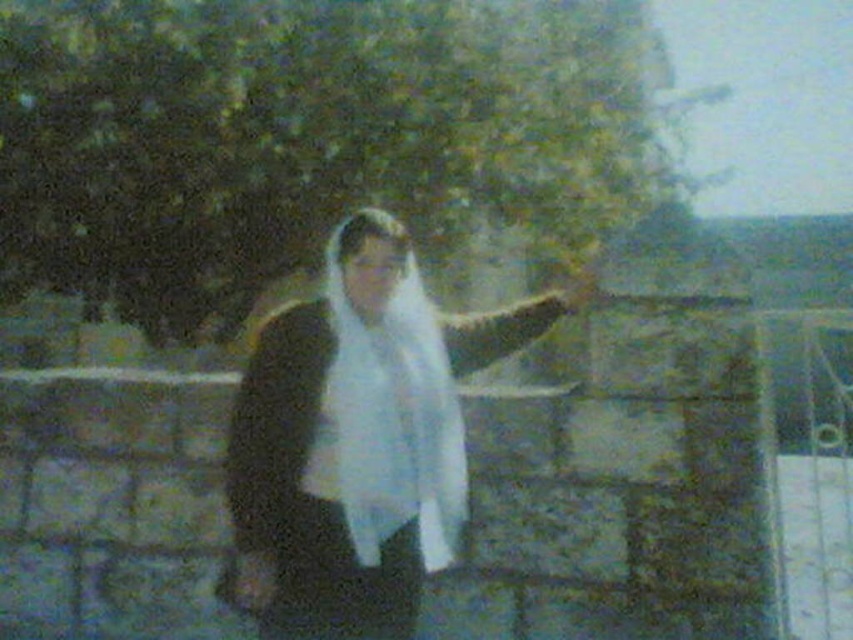
Is point (438, 563) positioned in front of point (374, 554)?

No, (438, 563) is behind (374, 554).

Consider the image. Can you confirm if white matte scarf at center is positioned below white soft fabric veil at center?

Indeed, white matte scarf at center is positioned under white soft fabric veil at center.

This screenshot has width=853, height=640. Identify the location of white matte scarf at center. (358, 440).